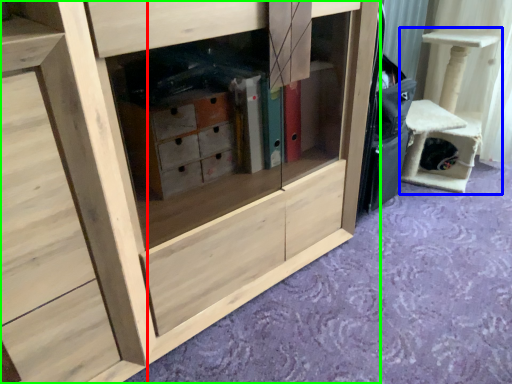
Question: Which object is positioned closest to chest of drawers (highlighted by a red box)? Select from furniture (highlighted by a blue box) and cabinetry (highlighted by a green box).

Choices:
 (A) furniture
 (B) cabinetry

Answer: (B)